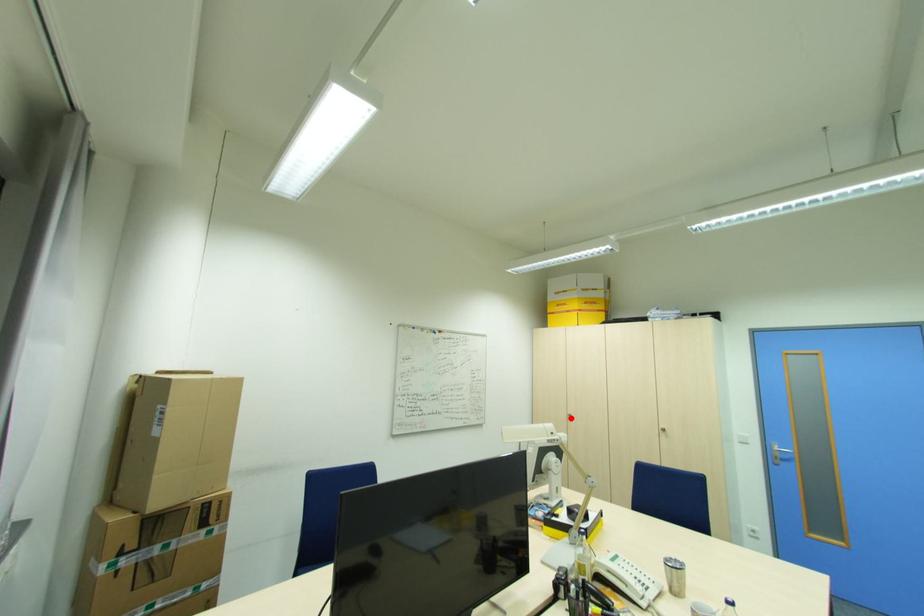
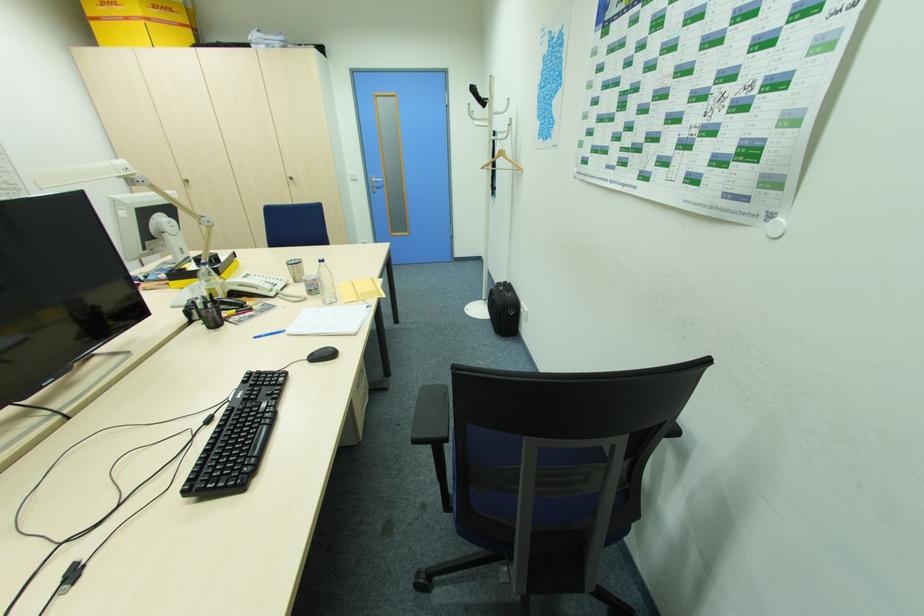
Find the pixel in the second image that matches the highlighted location in the first image.

(188, 185)